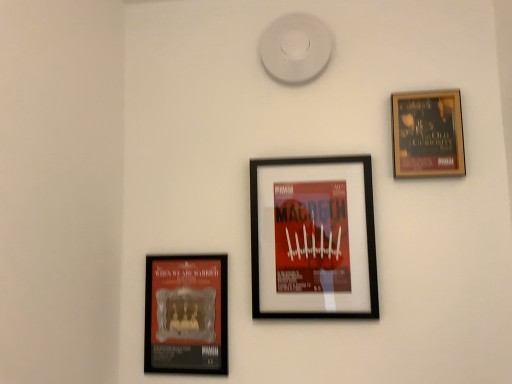
Question: In which direction should I rotate to look at black matte picture frame at center, the 2th picture frame positioned from the right?

Choices:
 (A) right
 (B) left

Answer: (A)

Question: Does black matte picture frame at center, the 2th picture frame positioned from the right, contain matte black poster at lower left, arranged as the first picture frame when viewed from the left?

Choices:
 (A) no
 (B) yes

Answer: (A)

Question: Is black matte picture frame at center, arranged as the second picture frame when viewed from the left, positioned behind matte black poster at lower left, the 3th picture frame viewed from the right?

Choices:
 (A) no
 (B) yes

Answer: (A)

Question: Is the position of black matte picture frame at center, the 2th picture frame positioned from the right, less distant than that of matte black poster at lower left, the 3th picture frame viewed from the right?

Choices:
 (A) yes
 (B) no

Answer: (A)

Question: From a real-world perspective, does black matte picture frame at center, the 2th picture frame positioned from the right, sit lower than matte black poster at lower left, arranged as the first picture frame when viewed from the left?

Choices:
 (A) no
 (B) yes

Answer: (A)

Question: Does black matte picture frame at center, arranged as the second picture frame when viewed from the left, have a greater width compared to matte black poster at lower left, arranged as the first picture frame when viewed from the left?

Choices:
 (A) yes
 (B) no

Answer: (A)

Question: Is black matte picture frame at center, arranged as the second picture frame when viewed from the left, directly adjacent to matte black poster at lower left, arranged as the first picture frame when viewed from the left?

Choices:
 (A) no
 (B) yes

Answer: (A)

Question: Would you say wooden framed poster at upper right, the third picture frame viewed from the left, contains black matte picture frame at center, arranged as the second picture frame when viewed from the left?

Choices:
 (A) yes
 (B) no

Answer: (B)

Question: Is wooden framed poster at upper right, the third picture frame viewed from the left, wider than black matte picture frame at center, the 2th picture frame positioned from the right?

Choices:
 (A) yes
 (B) no

Answer: (B)

Question: Can you confirm if wooden framed poster at upper right, which is the 1th picture frame from right to left, is bigger than black matte picture frame at center, the 2th picture frame positioned from the right?

Choices:
 (A) yes
 (B) no

Answer: (B)

Question: Can you confirm if wooden framed poster at upper right, which is the 1th picture frame from right to left, is taller than black matte picture frame at center, the 2th picture frame positioned from the right?

Choices:
 (A) yes
 (B) no

Answer: (B)

Question: Considering the relative sizes of wooden framed poster at upper right, the third picture frame viewed from the left, and black matte picture frame at center, arranged as the second picture frame when viewed from the left, in the image provided, is wooden framed poster at upper right, the third picture frame viewed from the left, thinner than black matte picture frame at center, arranged as the second picture frame when viewed from the left,?

Choices:
 (A) yes
 (B) no

Answer: (A)

Question: From a real-world perspective, is wooden framed poster at upper right, which is the 1th picture frame from right to left, located higher than black matte picture frame at center, arranged as the second picture frame when viewed from the left?

Choices:
 (A) yes
 (B) no

Answer: (A)

Question: Is the position of wooden framed poster at upper right, the third picture frame viewed from the left, more distant than that of matte black poster at lower left, the 3th picture frame viewed from the right?

Choices:
 (A) yes
 (B) no

Answer: (B)